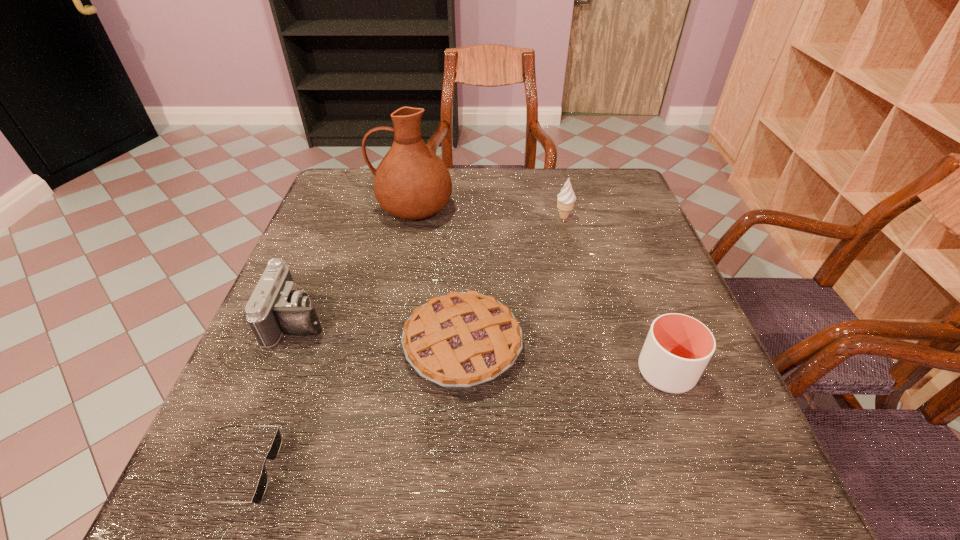
The image size is (960, 540). In order to click on object that is the third closest to the cup in this screenshot , I will do `click(411, 182)`.

Identify the location of object that is the closest to the shortest object. This screenshot has width=960, height=540. (276, 306).

The width and height of the screenshot is (960, 540). Identify the location of vacant region that satisfies the following two spatial constraints: 1. on the front side of the pie; 2. on the right side of the rightmost object. (x=462, y=372).

I want to click on vacant space that satisfies the following two spatial constraints: 1. on the front-facing side of the icecream; 2. at the front of the camera with an open lens cover, so click(588, 319).

You are a GUI agent. You are given a task and a screenshot of the screen. Output one action in this format:
    pyautogui.click(x=<x>, y=<y>)
    Task: Click on the free spot that satisfies the following two spatial constraints: 1. on the side of the tallest object with the handle; 2. on the back side of the fifth tallest object
    
    Given the screenshot: What is the action you would take?
    pyautogui.click(x=386, y=346)

Locate an element on the screen. The width and height of the screenshot is (960, 540). vacant area that satisfies the following two spatial constraints: 1. on the side of the tallest object with the handle; 2. on the back side of the cup is located at coordinates (381, 372).

The height and width of the screenshot is (540, 960). What are the coordinates of `free space in the image that satisfies the following two spatial constraints: 1. on the side of the tallest object with the handle; 2. on the right side of the rightmost object` in the screenshot? It's located at (381, 372).

Find the location of `free space that satisfies the following two spatial constraints: 1. on the side of the tallest object with the handle; 2. on the left side of the fifth tallest object`. free space that satisfies the following two spatial constraints: 1. on the side of the tallest object with the handle; 2. on the left side of the fifth tallest object is located at coordinates (386, 346).

Identify the location of free location that satisfies the following two spatial constraints: 1. at the front of the camera with an open lens cover; 2. on the right side of the rightmost object. This screenshot has height=540, width=960. (278, 372).

Where is `free location that satisfies the following two spatial constraints: 1. at the front of the second shortest object with an open lens cover; 2. on the right side of the camera`? This screenshot has height=540, width=960. free location that satisfies the following two spatial constraints: 1. at the front of the second shortest object with an open lens cover; 2. on the right side of the camera is located at coordinates (289, 346).